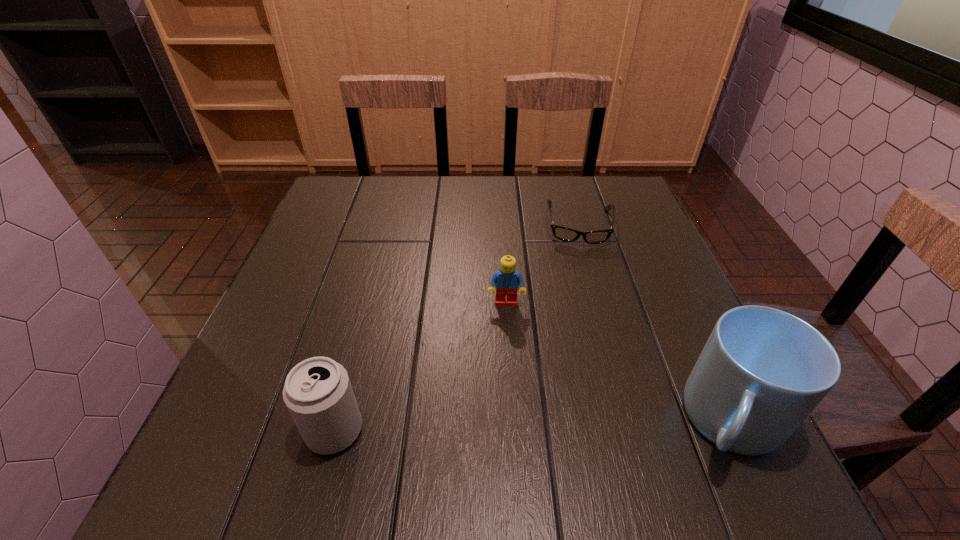
I want to click on vacant area between the second tallest object and the tallest object, so click(533, 426).

Find the location of a particular element. Image resolution: width=960 pixels, height=540 pixels. object that is the second closest to the tallest object is located at coordinates (562, 233).

Locate an element on the screen. Image resolution: width=960 pixels, height=540 pixels. object that is the second closest to the can is located at coordinates (762, 371).